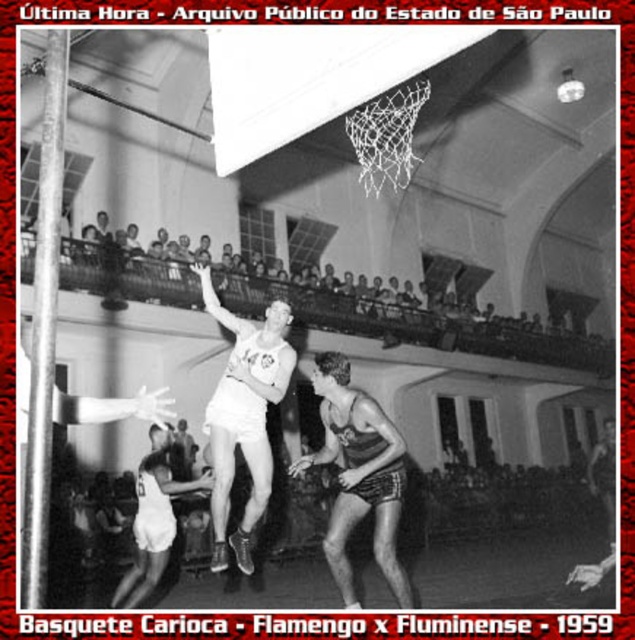
Question: Is smooth leather shorts at center closer to camera compared to white matte basketball player at center?

Choices:
 (A) no
 (B) yes

Answer: (B)

Question: Which of the following is the farthest from the observer?

Choices:
 (A) (142, 600)
 (B) (291, 348)

Answer: (A)

Question: Can you confirm if smooth leather shorts at center is wider than white matte basketball player at center?

Choices:
 (A) no
 (B) yes

Answer: (B)

Question: Can you confirm if white matte basketball player at center is positioned to the left of white matte shorts at center?

Choices:
 (A) yes
 (B) no

Answer: (B)

Question: Which point appears farthest from the camera in this image?

Choices:
 (A) (384, 563)
 (B) (161, 493)
 (C) (211, 401)

Answer: (B)

Question: Which of the following is the farthest from the observer?

Choices:
 (A) (161, 573)
 (B) (222, 544)

Answer: (A)